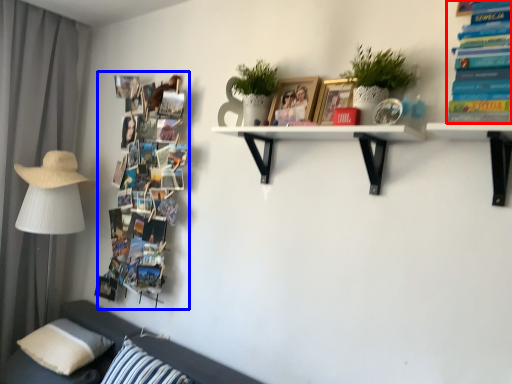
Question: Which object appears farthest to the camera in this image, book (highlighted by a red box) or book (highlighted by a blue box)?

Choices:
 (A) book
 (B) book

Answer: (B)